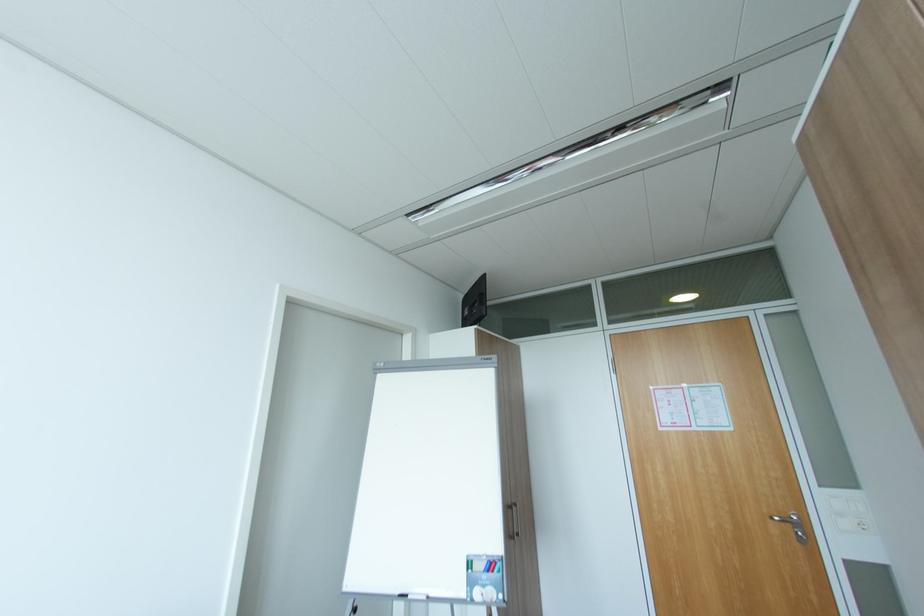
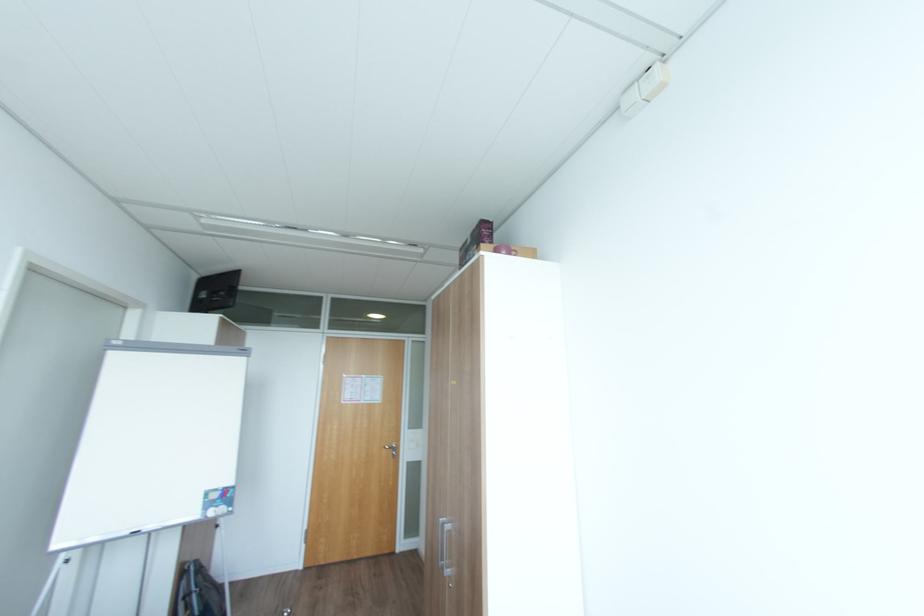
Where in the second image is the point corresponding to point 783,517 from the first image?

(392, 448)